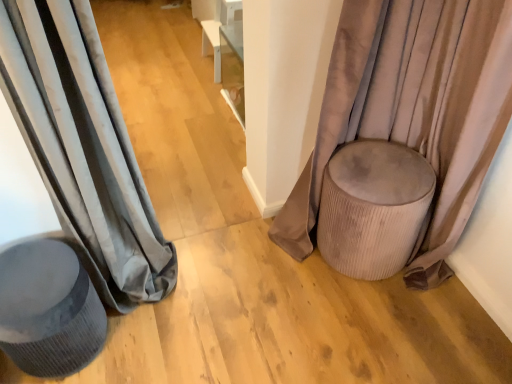
Identify the location of vacant space underneath matte gray curtain at left, the 2th curtain positioned from the right (from a real-world perspective). Image resolution: width=512 pixels, height=384 pixels. (168, 283).